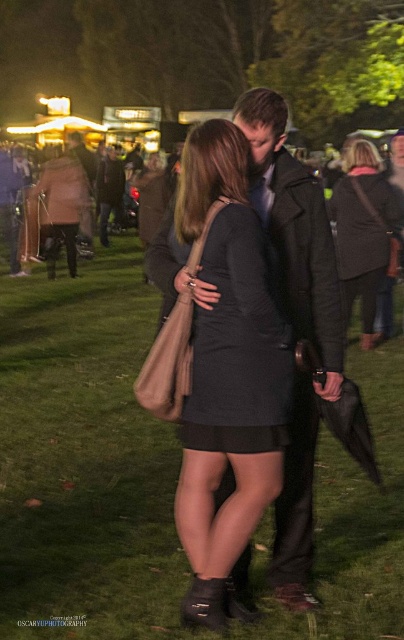
Question: Which of the following is the closest to the observer?

Choices:
 (A) black matte dress at center
 (B) dark gray dress at center
 (C) matte black dress at center

Answer: (A)

Question: Can you confirm if green grass at center is positioned to the left of black leather jacket at center?

Choices:
 (A) no
 (B) yes

Answer: (B)

Question: Estimate the real-world distances between objects in this image. Which object is farther from the black matte dress at center?

Choices:
 (A) black leather jacket at center
 (B) matte black dress at center
 (C) dark gray dress at center

Answer: (C)

Question: Is green grass at center bigger than black leather jacket at center?

Choices:
 (A) yes
 (B) no

Answer: (B)

Question: Estimate the real-world distances between objects in this image. Which object is closer to the matte black dress at center?

Choices:
 (A) dark gray dress at center
 (B) black matte dress at center
 (C) black leather jacket at center

Answer: (B)

Question: Is black leather jacket at center further to camera compared to dark gray dress at center?

Choices:
 (A) no
 (B) yes

Answer: (A)